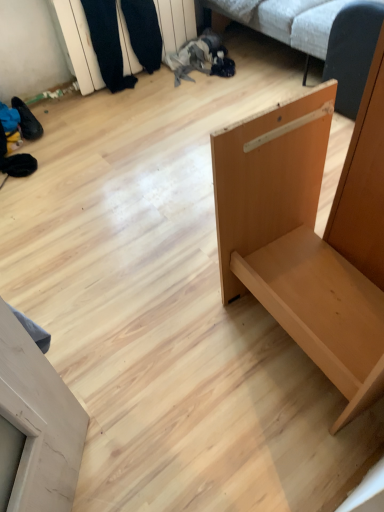
Question: Would you say light brown wood shelf at right, which is the 2th furniture from left to right, is to the left or to the right of wooden shelf at upper left in the picture?

Choices:
 (A) left
 (B) right

Answer: (B)

Question: From the image's perspective, is light brown wood shelf at right, which is the 2th furniture from left to right, positioned above or below wooden shelf at upper left?

Choices:
 (A) below
 (B) above

Answer: (A)

Question: Considering the real-world distances, which object is farthest from the light brown wood shelf at right, which is the 2th furniture from left to right?

Choices:
 (A) light brown wood door at lower left, acting as the 2th furniture starting from the right
 (B) white fabric couch at upper center
 (C) wooden shelf at upper left

Answer: (C)

Question: Estimate the real-world distances between objects in this image. Which object is farther from the wooden shelf at upper left?

Choices:
 (A) light brown wood shelf at right, the 1th furniture from the right
 (B) white fabric couch at upper center
 (C) light brown wood door at lower left, acting as the 2th furniture starting from the right

Answer: (C)